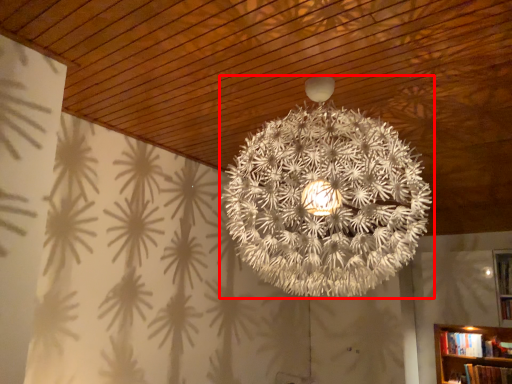
Question: From the image's perspective, what is the correct spatial positioning of lamp (annotated by the red box) in reference to book?

Choices:
 (A) above
 (B) below

Answer: (A)